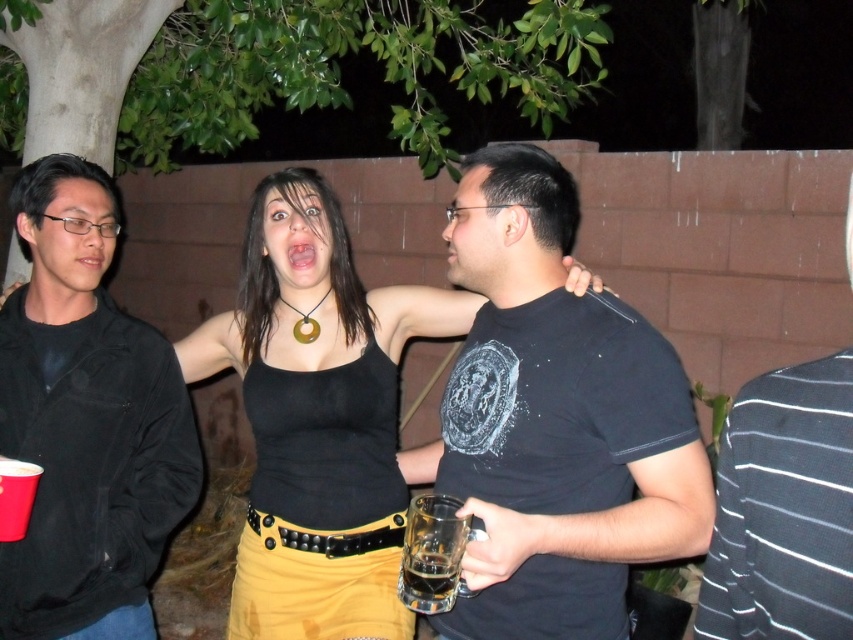
In the nighttime gathering scene, there are two people wearing the black tank top at center and the striped cotton shirt at right. Which one is positioned more to the right side of the image?

The striped cotton shirt at right is positioned more to the right side of the image.